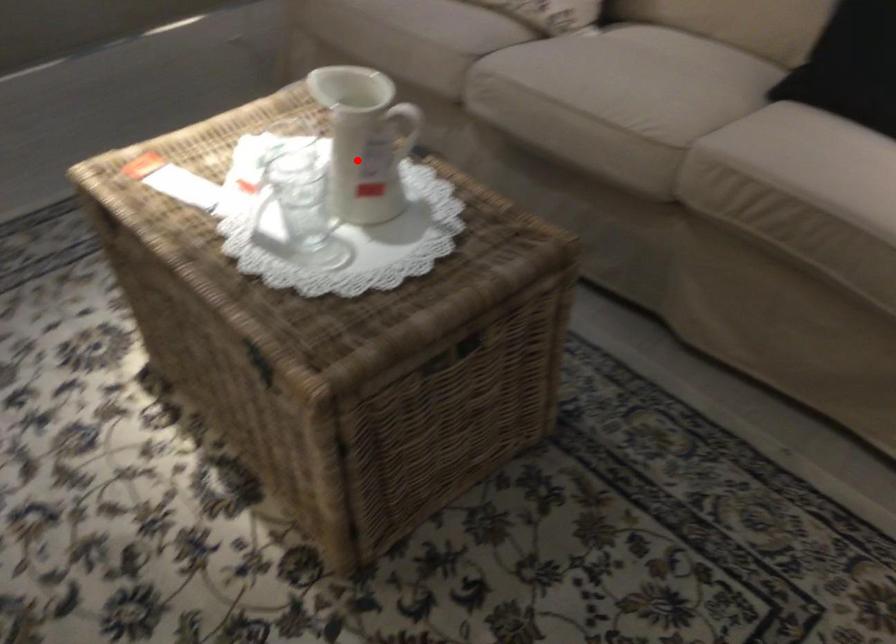
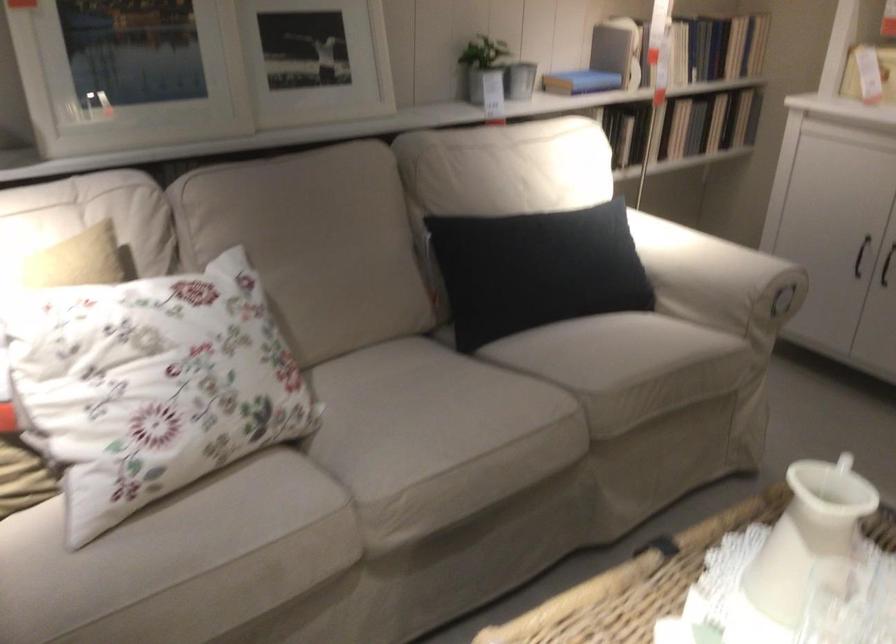
Question: I am providing you with two images of the same scene from different viewpoints. A red point is marked on the first image. Can you still see the location of the red point in image 2?

Choices:
 (A) Yes
 (B) No

Answer: (A)